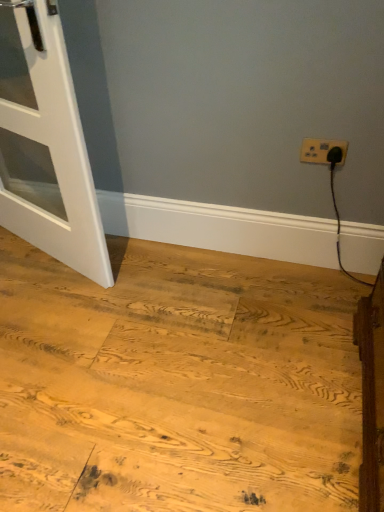
Where is `unoccupied area in front of white matte door at left`? Image resolution: width=384 pixels, height=512 pixels. unoccupied area in front of white matte door at left is located at coordinates (55, 315).